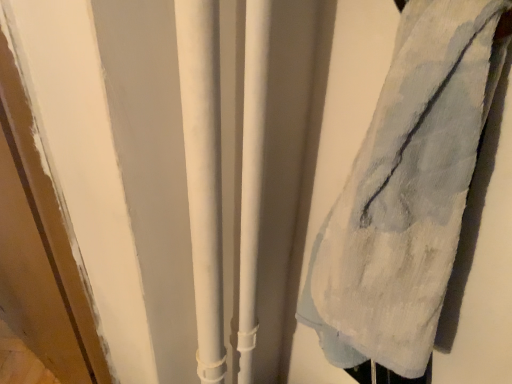
The width and height of the screenshot is (512, 384). What are the coordinates of `light blue cotton towel at right` in the screenshot? It's located at (407, 192).

What do you see at coordinates (407, 192) in the screenshot?
I see `light blue cotton towel at right` at bounding box center [407, 192].

This screenshot has height=384, width=512. Identify the location of light blue cotton towel at right. (407, 192).